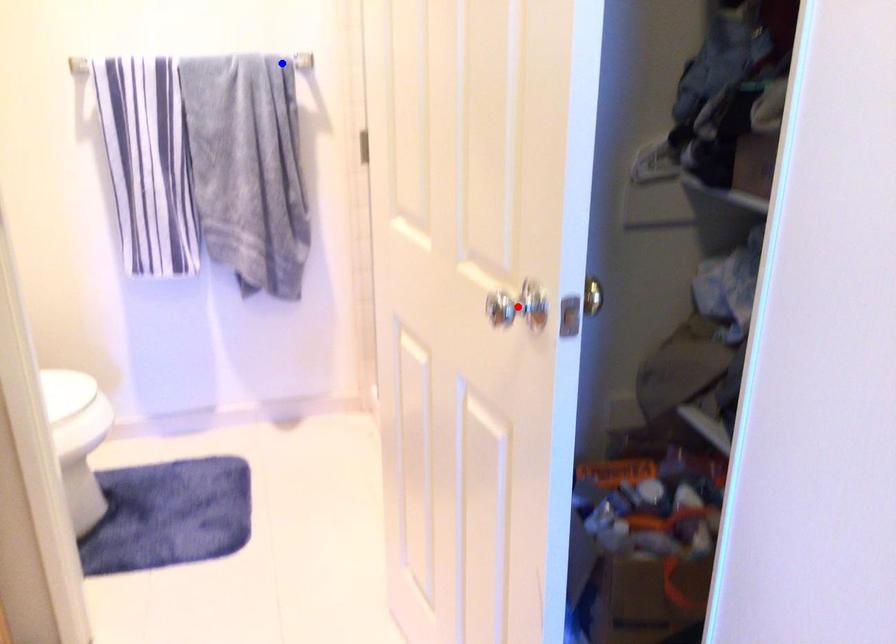
Question: In the image, two points are highlighted. Which point is nearer to the camera? Reply with the corresponding letter.

Choices:
 (A) blue point
 (B) red point

Answer: (B)